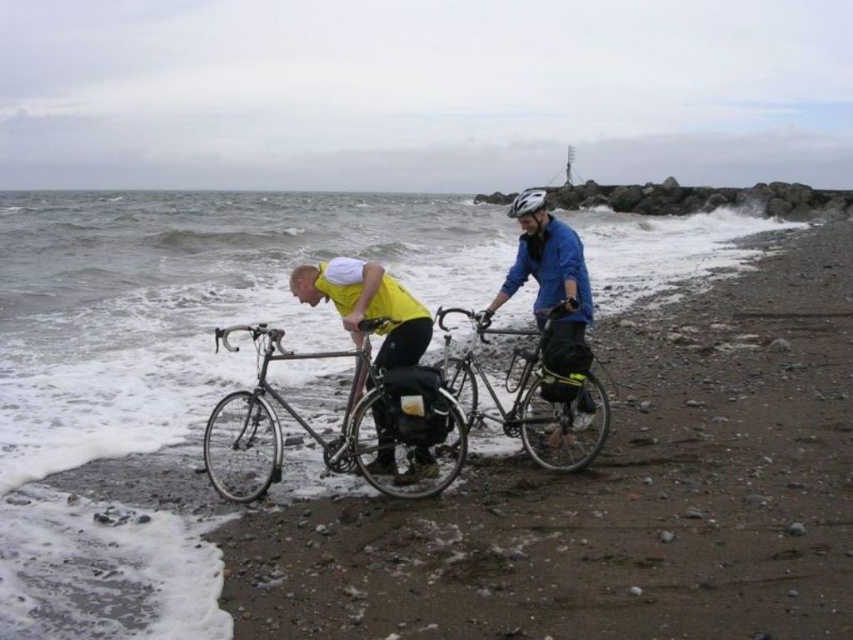
Question: Where is matte yellow jacket at center located in relation to shiny black bicycle at center in the image?

Choices:
 (A) below
 (B) above

Answer: (B)

Question: Which point is closer to the camera?

Choices:
 (A) matte yellow jacket at center
 (B) shiny metallic bicycle at center
 (C) yellow matte shirt at center

Answer: (C)

Question: Which point is closer to the camera taking this photo?

Choices:
 (A) (347, 321)
 (B) (543, 205)
 (C) (566, 268)
 (D) (339, 289)

Answer: (A)

Question: Which point appears closest to the camera in this image?

Choices:
 (A) (386, 468)
 (B) (532, 189)
 (C) (334, 285)

Answer: (C)

Question: Does shiny black bicycle at center have a greater width compared to yellow fabric safety vest at center?

Choices:
 (A) no
 (B) yes

Answer: (B)

Question: Is the position of shiny black bicycle at center less distant than that of shiny metallic bicycle at center?

Choices:
 (A) no
 (B) yes

Answer: (B)